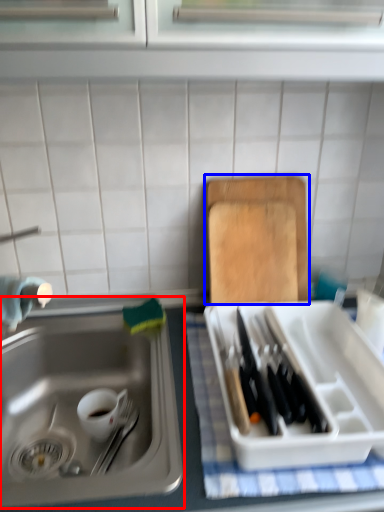
Question: Which of the following is the closest to the observer, sink (highlighted by a red box) or cutting board (highlighted by a blue box)?

Choices:
 (A) sink
 (B) cutting board

Answer: (A)